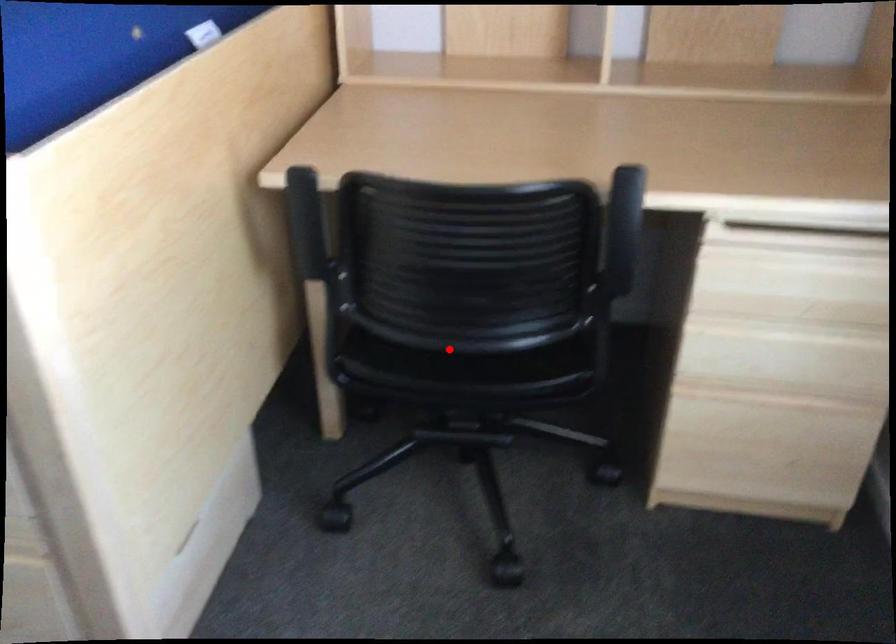
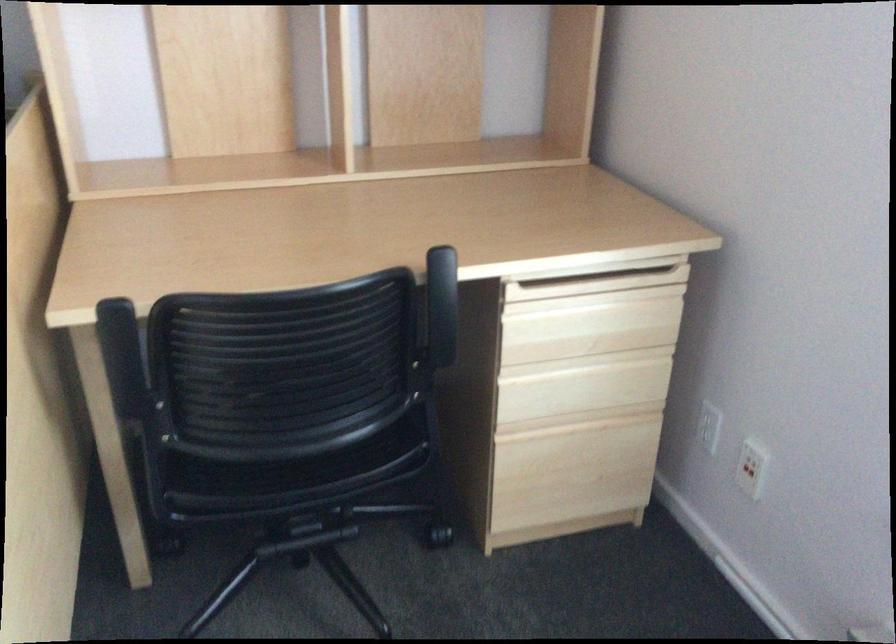
Locate, in the second image, the point that corresponds to the highlighted location in the first image.

(296, 455)